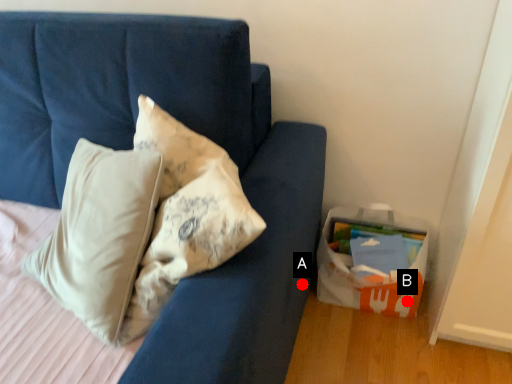
Question: Two points are circled on the image, labeled by A and B beside each circle. Which of the following is the farthest from the observer?

Choices:
 (A) A is further
 (B) B is further

Answer: (B)